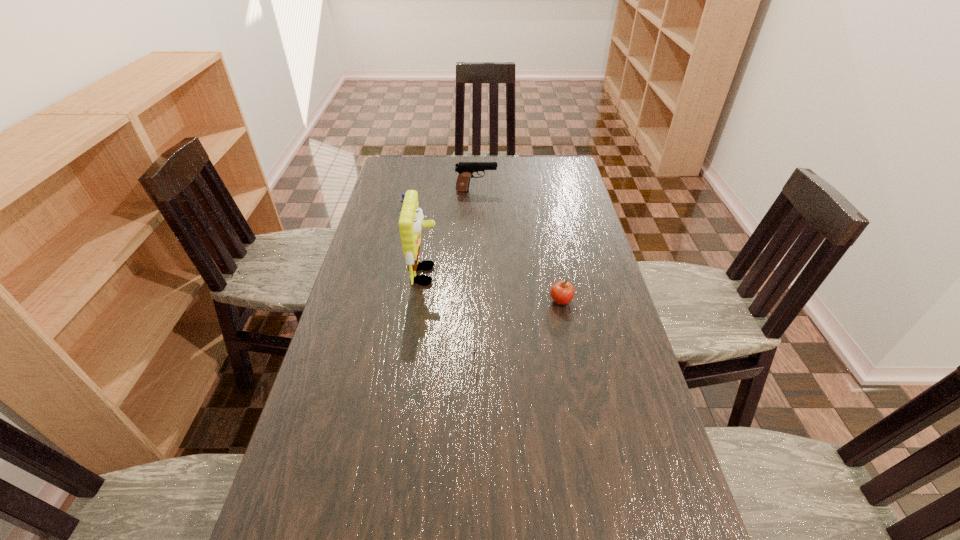
Where is `the tallest object`? This screenshot has height=540, width=960. the tallest object is located at coordinates (411, 222).

You are a GUI agent. You are given a task and a screenshot of the screen. Output one action in this format:
    pyautogui.click(x=<x>, y=<y>)
    Task: Click on the second object from left to right
    The width and height of the screenshot is (960, 540).
    Given the screenshot: What is the action you would take?
    pyautogui.click(x=411, y=222)

Find the location of `pistol`. pistol is located at coordinates (465, 170).

Image resolution: width=960 pixels, height=540 pixels. What are the coordinates of `duckling` in the screenshot? It's located at (403, 194).

Where is `the leftmost object`? Image resolution: width=960 pixels, height=540 pixels. the leftmost object is located at coordinates (403, 194).

This screenshot has height=540, width=960. Identify the location of the rightmost object. (562, 292).

I want to click on apple, so click(x=562, y=292).

Locate an element on the screen. This screenshot has height=540, width=960. sunglasses is located at coordinates (475, 347).

This screenshot has width=960, height=540. In order to click on the nearest object in this screenshot , I will do `click(475, 347)`.

The image size is (960, 540). In order to click on blank space located on the face of the fourth object from right to left in this screenshot , I will do `click(533, 275)`.